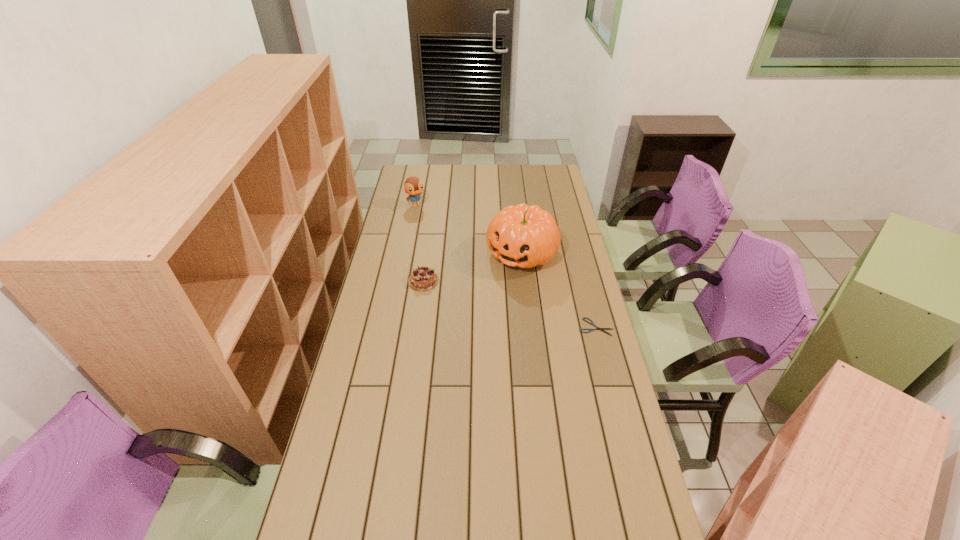
This screenshot has width=960, height=540. I want to click on vacant space at the near edge of the desktop, so click(447, 529).

This screenshot has width=960, height=540. I want to click on vacant space at the left edge of the desktop, so click(x=382, y=241).

Locate an element on the screen. This screenshot has height=540, width=960. vacant area at the right edge of the desktop is located at coordinates (567, 212).

Where is `vacant area at the far left corner`? This screenshot has width=960, height=540. vacant area at the far left corner is located at coordinates (422, 172).

This screenshot has width=960, height=540. Identify the location of vacant space at the far right corner of the desktop. (558, 179).

The image size is (960, 540). Identify the location of vacant area between the rightmost object and the chocolate cake. (510, 304).

Where is `vacant area that lies between the shears and the pumpkin`? Image resolution: width=960 pixels, height=540 pixels. vacant area that lies between the shears and the pumpkin is located at coordinates (559, 290).

Locate an element on the screen. The width and height of the screenshot is (960, 540). free spot between the third object from left to right and the farthest object is located at coordinates (468, 229).

At what (x,y) coordinates should I click in order to perform the action: click on free space between the tallest object and the second shortest object. Please return your answer as a coordinate pair (x, y). Looking at the image, I should click on (472, 267).

This screenshot has height=540, width=960. Identify the location of vacant area that lies between the chocolate cake and the tallest object. (472, 267).